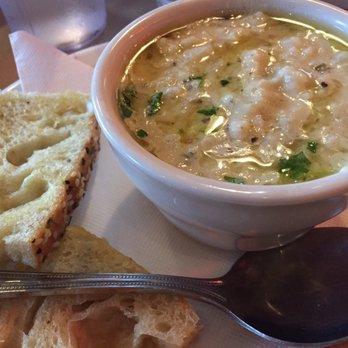
In order to click on rim of bowl in this screenshot , I will do `click(336, 7)`, `click(93, 86)`.